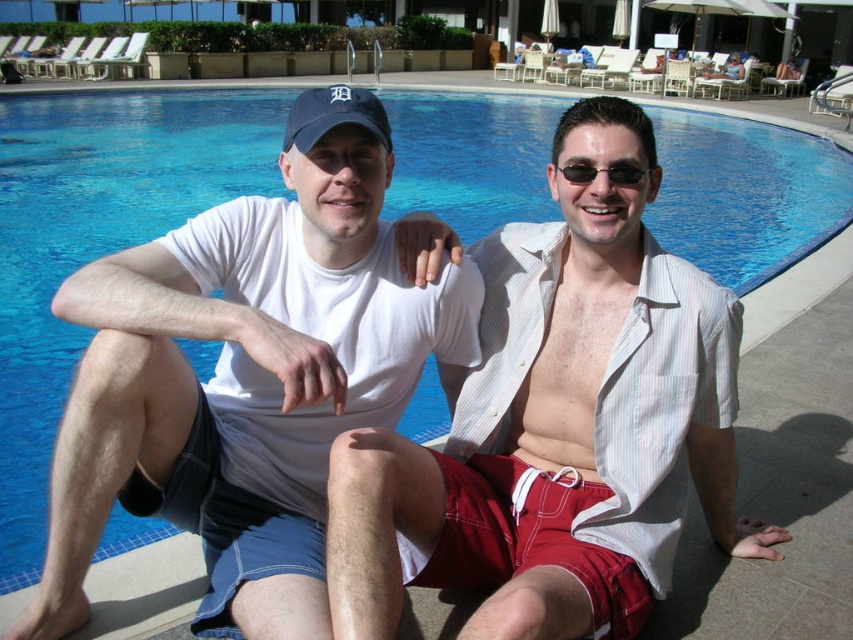
Between point (630, 148) and point (585, 179), which one is positioned behind?

Point (630, 148)

Between white cotton shirt at center and sunglasses at center, which one is positioned lower?

white cotton shirt at center is below.

Is point (488, 272) positioned before point (613, 179)?

No, (488, 272) is further to viewer.

Find the location of a particular element. The width and height of the screenshot is (853, 640). white cotton shirt at center is located at coordinates (560, 424).

Does white cotton t-shirt at center lie in front of sunglasses at center?

Yes, it is.

Is point (300, 532) closer to camera compared to point (648, 172)?

That is False.

Locate an element on the screen. This screenshot has width=853, height=640. white cotton t-shirt at center is located at coordinates (247, 376).

Which is below, white cotton shirt at center or white cotton t-shirt at center?

Positioned lower is white cotton shirt at center.

Who is positioned more to the right, white cotton shirt at center or white cotton t-shirt at center?

Positioned to the right is white cotton shirt at center.

Where is `white cotton shirt at center`? Image resolution: width=853 pixels, height=640 pixels. white cotton shirt at center is located at coordinates (560, 424).

The height and width of the screenshot is (640, 853). Find the location of `white cotton shirt at center`. white cotton shirt at center is located at coordinates (560, 424).